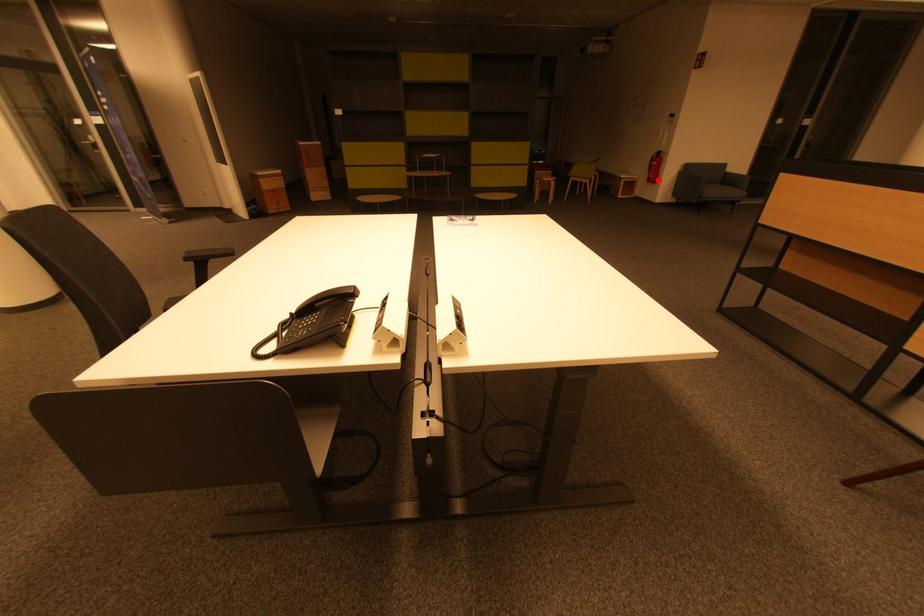
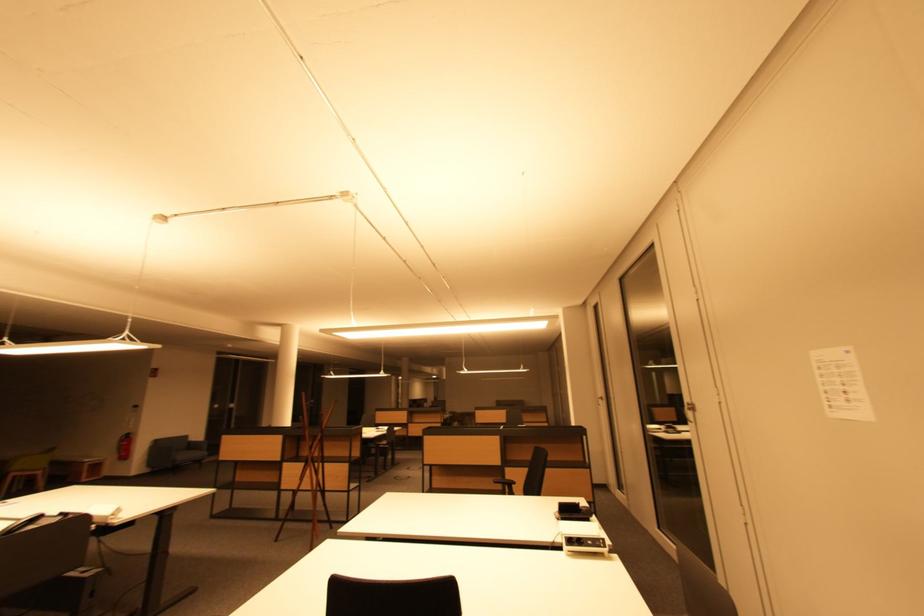
Find the pixel in the second image that matches the highlighted location in the first image.

(128, 458)